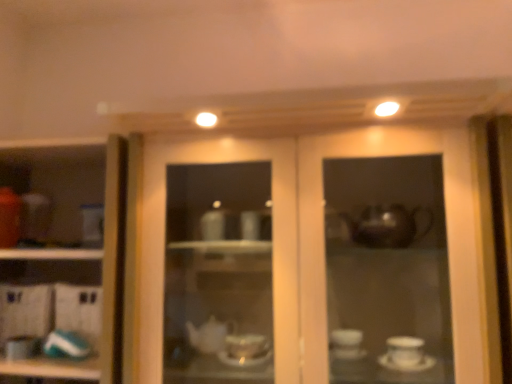
Question: Considering the relative sizes of white glossy cup at left and matte glass cabinet at center in the image provided, is white glossy cup at left taller than matte glass cabinet at center?

Choices:
 (A) no
 (B) yes

Answer: (A)

Question: Is white glossy cup at left aimed at matte glass cabinet at center?

Choices:
 (A) no
 (B) yes

Answer: (A)

Question: From the image's perspective, is white glossy cup at left located above matte glass cabinet at center?

Choices:
 (A) yes
 (B) no

Answer: (B)

Question: Is white glossy cup at left wider than matte glass cabinet at center?

Choices:
 (A) yes
 (B) no

Answer: (B)

Question: Does white glossy cup at left come in front of matte glass cabinet at center?

Choices:
 (A) yes
 (B) no

Answer: (B)

Question: Considering the positions of point (302, 220) and point (38, 342), is point (302, 220) closer or farther from the camera than point (38, 342)?

Choices:
 (A) farther
 (B) closer

Answer: (B)

Question: Considering the relative positions of matte glass cabinet at center and matte white teapot at lower left, the 2th tableware in the right-to-left sequence, in the image provided, is matte glass cabinet at center to the left or to the right of matte white teapot at lower left, the 2th tableware in the right-to-left sequence,?

Choices:
 (A) left
 (B) right

Answer: (B)

Question: From a real-world perspective, is matte glass cabinet at center physically located above or below matte white teapot at lower left, the 2th tableware in the right-to-left sequence?

Choices:
 (A) below
 (B) above

Answer: (B)

Question: Relative to matte white teapot at lower left, which ranks as the first tableware in left-to-right order, is matte glass cabinet at center in front or behind?

Choices:
 (A) behind
 (B) front

Answer: (B)

Question: From a real-world perspective, relative to matte white teapot at lower left, which ranks as the first tableware in left-to-right order, is teal glossy plate at lower left, which appears as the first tableware when viewed from the right, vertically above or below?

Choices:
 (A) below
 (B) above

Answer: (B)

Question: From the image's perspective, relative to matte white teapot at lower left, which ranks as the first tableware in left-to-right order, is teal glossy plate at lower left, which appears as the first tableware when viewed from the right, above or below?

Choices:
 (A) above
 (B) below

Answer: (A)

Question: Looking at their shapes, would you say teal glossy plate at lower left, which appears as the first tableware when viewed from the right, is wider or thinner than matte white teapot at lower left, which ranks as the first tableware in left-to-right order?

Choices:
 (A) thin
 (B) wide

Answer: (A)

Question: Is teal glossy plate at lower left, which appears as the first tableware when viewed from the right, situated inside matte white teapot at lower left, the 2th tableware in the right-to-left sequence, or outside?

Choices:
 (A) inside
 (B) outside

Answer: (B)

Question: Based on their sizes in the image, would you say matte glass cabinet at center is bigger or smaller than teal glossy plate at lower left, which appears as the first tableware when viewed from the right?

Choices:
 (A) big
 (B) small

Answer: (A)

Question: From the image's perspective, relative to teal glossy plate at lower left, which appears as the first tableware when viewed from the right, is matte glass cabinet at center above or below?

Choices:
 (A) above
 (B) below

Answer: (A)